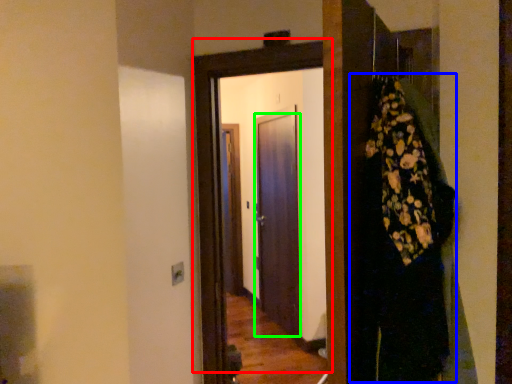
Question: Which object is the closest to the door (highlighted by a red box)? Choose among these: dress (highlighted by a blue box) or door (highlighted by a green box).

Choices:
 (A) dress
 (B) door

Answer: (A)